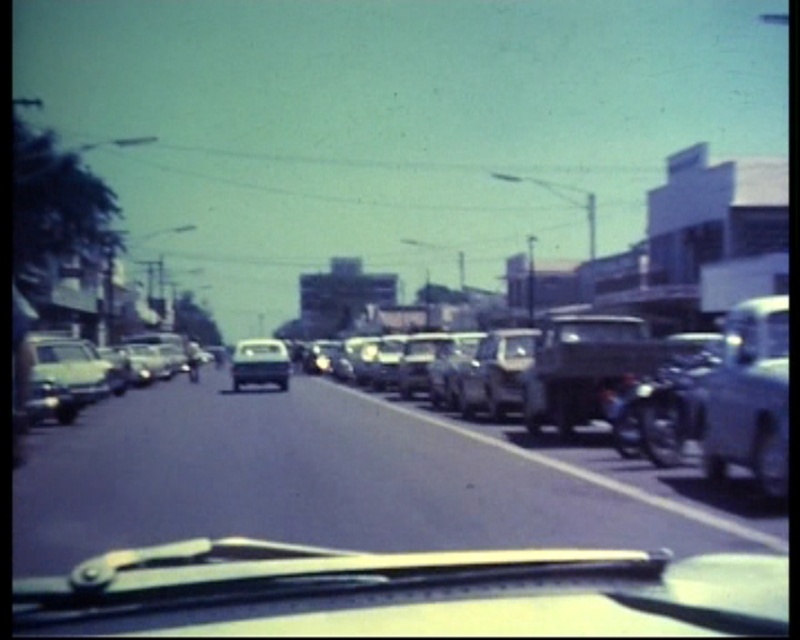
Is metallic silver truck at right thinner than metallic silver car at center?

No.

Who is more forward, (780, 300) or (472, 397)?

Point (780, 300) is more forward.

The height and width of the screenshot is (640, 800). In order to click on metallic silver truck at right in this screenshot , I will do `click(750, 396)`.

Between metallic silver truck at right and shiny silver sedan at center, which one appears on the left side from the viewer's perspective?

From the viewer's perspective, shiny silver sedan at center appears more on the left side.

Who is shorter, metallic silver truck at right or shiny silver sedan at center?

shiny silver sedan at center is shorter.

The width and height of the screenshot is (800, 640). What are the coordinates of `metallic silver truck at right` in the screenshot? It's located at (750, 396).

Is metallic silver car at center thinner than shiny silver sedan at center?

Yes.

The image size is (800, 640). What are the coordinates of `metallic silver car at center` in the screenshot? It's located at (496, 372).

Find the location of a particular element. Image resolution: width=800 pixels, height=640 pixels. metallic silver car at center is located at coordinates (496, 372).

Identify the location of metallic silver car at center. (496, 372).